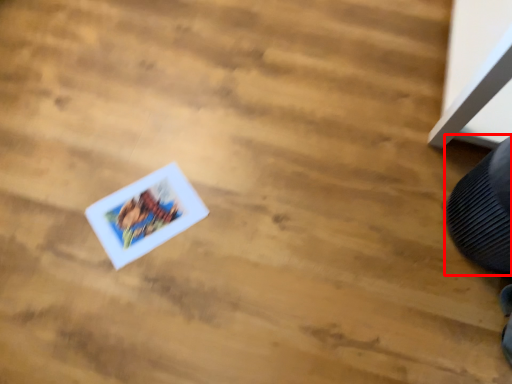
Question: From the image's perspective, where is shoe (annotated by the red box) located in relation to comic book in the image?

Choices:
 (A) below
 (B) above

Answer: (B)